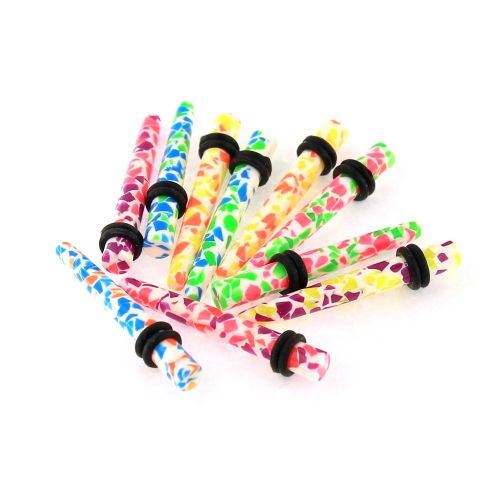
Where is `yellow and orange plug`? Image resolution: width=500 pixels, height=500 pixels. yellow and orange plug is located at coordinates (204, 214), (300, 194).